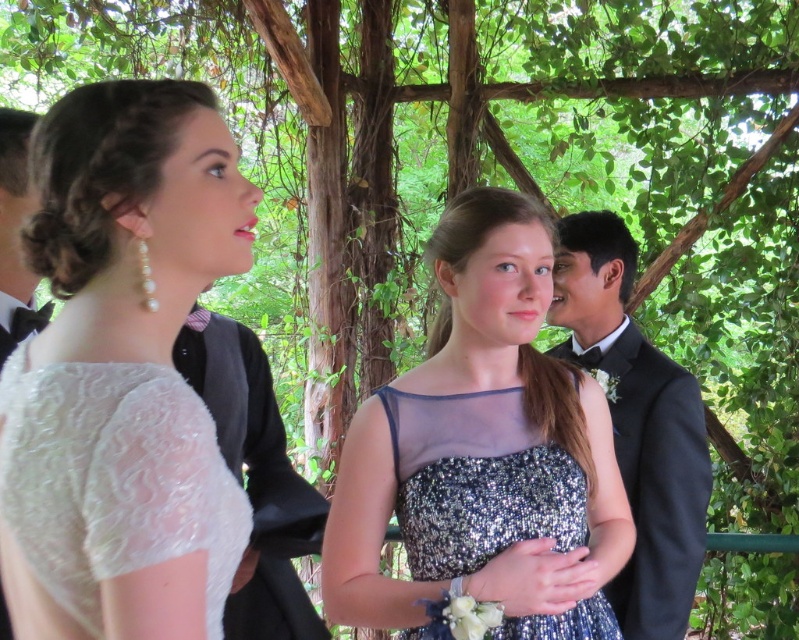
Question: Does pearl lace dress at upper left have a lesser width compared to shiny black suit at right?

Choices:
 (A) yes
 (B) no

Answer: (A)

Question: Does sparkly silver dress at center appear under sparkly blue dress at center?

Choices:
 (A) yes
 (B) no

Answer: (B)

Question: Considering the relative positions of shiny black suit at right and sparkly blue dress at center in the image provided, where is shiny black suit at right located with respect to sparkly blue dress at center?

Choices:
 (A) below
 (B) above

Answer: (B)

Question: Among these points, which one is nearest to the camera?

Choices:
 (A) (6, 280)
 (B) (692, 474)
 (C) (491, 509)
 (D) (408, 557)

Answer: (C)

Question: Which object appears closest to the camera in this image?

Choices:
 (A) pearl lace dress at upper left
 (B) sparkly blue dress at center
 (C) shiny black suit at right
 (D) sparkly silver dress at center

Answer: (A)

Question: Which of the following is the farthest from the observer?

Choices:
 (A) black satin bow tie at upper left
 (B) sparkly blue dress at center
 (C) shiny black suit at right
 (D) pearl lace dress at upper left

Answer: (C)